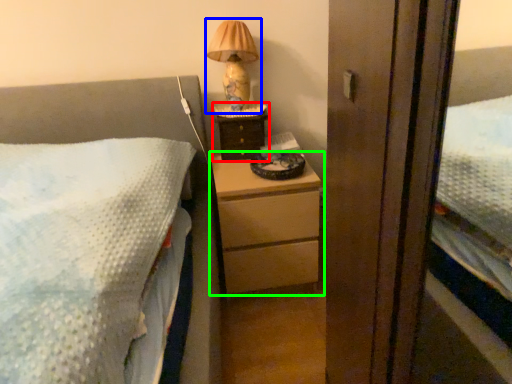
Question: Considering the real-world distances, which object is closest to nightstand (highlighted by a red box)? table lamp (highlighted by a blue box) or chest of drawers (highlighted by a green box).

Choices:
 (A) table lamp
 (B) chest of drawers

Answer: (A)